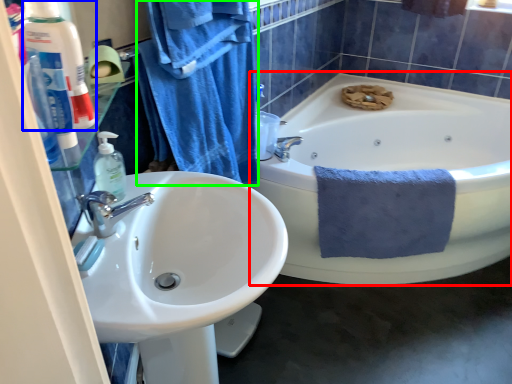
Question: Considering the real-world distances, which object is closest to bathtub (highlighted by a red box)? toiletry (highlighted by a blue box) or bath towel (highlighted by a green box).

Choices:
 (A) toiletry
 (B) bath towel

Answer: (B)